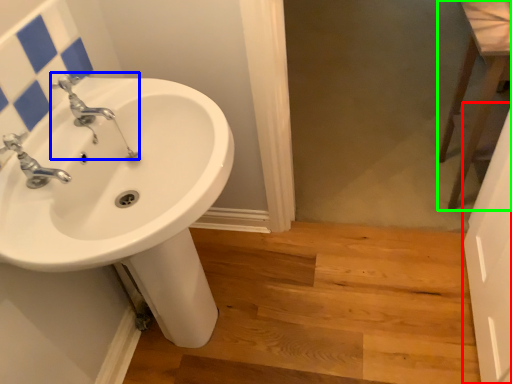
Question: Based on their relative distances, which object is nearer to screen door (highlighted by a red box)? Choose from plumbing fixture (highlighted by a blue box) and level (highlighted by a green box).

Choices:
 (A) plumbing fixture
 (B) level

Answer: (B)